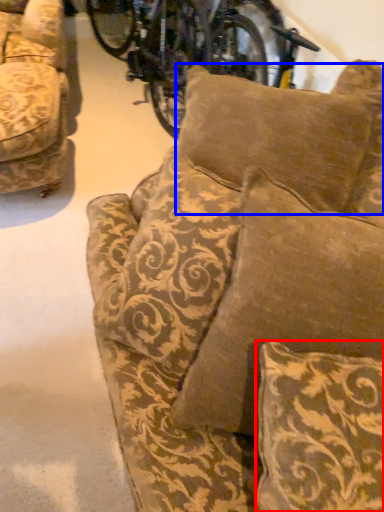
Question: Which object is closer to the camera taking this photo, pillow (highlighted by a red box) or pillow (highlighted by a blue box)?

Choices:
 (A) pillow
 (B) pillow

Answer: (A)